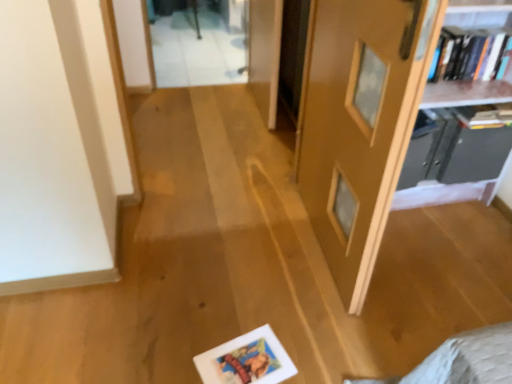
What do you see at coordinates (246, 360) in the screenshot?
I see `white matte picture frame at lower center` at bounding box center [246, 360].

From the picture: What is the approximate width of matte wooden door at center?

5.93 inches.

In order to face wooden bookshelf at upper right, arranged as the first shelf when viewed from the top, should I rotate leftwards or rightwards?

You should look right and rotate roughly 23.875 degrees.

The width and height of the screenshot is (512, 384). I want to click on wooden bookshelf at upper right, arranged as the first shelf when viewed from the top, so click(x=462, y=113).

Find the location of `black plastic shelf at upper right, marked as the 1th shelf in a bottom-to-top arrangement`. black plastic shelf at upper right, marked as the 1th shelf in a bottom-to-top arrangement is located at coordinates (453, 150).

How much space does black plastic shelf at upper right, marked as the 1th shelf in a bottom-to-top arrangement, occupy horizontally?

The width of black plastic shelf at upper right, marked as the 1th shelf in a bottom-to-top arrangement, is 17.64 inches.

Locate an element on the screen. transparent glass door at upper center is located at coordinates (196, 49).

Locate an element on the screen. The image size is (512, 384). hardcover book at upper right, which is the second book in top-to-bottom order is located at coordinates (484, 116).

Locate an element on the screen. The height and width of the screenshot is (384, 512). white matte picture frame at lower center is located at coordinates (246, 360).

Which is more to the left, white matte picture frame at lower center or hardcover book at upper right, the first book from the bottom?

white matte picture frame at lower center.

From the image's perspective, is white matte picture frame at lower center above or below hardcover book at upper right, which is the second book in top-to-bottom order?

From the image's perspective, white matte picture frame at lower center appears below hardcover book at upper right, which is the second book in top-to-bottom order.

Is white matte picture frame at lower center in contact with hardcover book at upper right, the first book from the bottom?

white matte picture frame at lower center and hardcover book at upper right, the first book from the bottom, are clearly separated.

Could you tell me if wooden bookshelf at upper right, which appears as the 2th shelf when ordered from the bottom, is turned towards white matte picture frame at lower center?

No, wooden bookshelf at upper right, which appears as the 2th shelf when ordered from the bottom, is not turned towards white matte picture frame at lower center.

Which is in front, point (432, 186) or point (213, 355)?

The point (213, 355) is in front.

The width and height of the screenshot is (512, 384). I want to click on picture frame directly beneath the wooden bookshelf at upper right, arranged as the first shelf when viewed from the top (from a real-world perspective), so click(246, 360).

Is the depth of matte wooden door at center greater than that of hardcover book at upper right, which is the second book in top-to-bottom order?

No, the depth of matte wooden door at center is less than that of hardcover book at upper right, which is the second book in top-to-bottom order.

From a real-world perspective, which is physically above, matte wooden door at center or hardcover book at upper right, which is the second book in top-to-bottom order?

matte wooden door at center is physically above.

Based on the photo, does matte wooden door at center turn towards hardcover book at upper right, which is the second book in top-to-bottom order?

No, matte wooden door at center is not aimed at hardcover book at upper right, which is the second book in top-to-bottom order.

Measure the distance between matte wooden door at center and hardcover book at upper right, which is the second book in top-to-bottom order.

The distance of matte wooden door at center from hardcover book at upper right, which is the second book in top-to-bottom order, is 59.35 centimeters.

Looking at this image, does white matte picture frame at lower center have a larger size compared to matte wooden door at center?

Actually, white matte picture frame at lower center might be smaller than matte wooden door at center.

From the image's perspective, between white matte picture frame at lower center and matte wooden door at center, which one is located above?

matte wooden door at center, from the image's perspective.

Is the position of white matte picture frame at lower center less distant than that of matte wooden door at center?

No, the depth of white matte picture frame at lower center is greater than that of matte wooden door at center.

Is white matte picture frame at lower center oriented towards matte wooden door at center?

No, white matte picture frame at lower center is not oriented towards matte wooden door at center.

What's the angular difference between black plastic shelf at upper right, which ranks as the second shelf in top-to-bottom order, and hardcover books at upper right, which is the second book from bottom to top,'s facing directions?

There is a 1.72-degree angle between the facing directions of black plastic shelf at upper right, which ranks as the second shelf in top-to-bottom order, and hardcover books at upper right, which is the second book from bottom to top.

From a real-world perspective, is black plastic shelf at upper right, marked as the 1th shelf in a bottom-to-top arrangement, above or below hardcover books at upper right, which is the second book from bottom to top?

black plastic shelf at upper right, marked as the 1th shelf in a bottom-to-top arrangement, is situated lower than hardcover books at upper right, which is the second book from bottom to top, in the real world.

Who is shorter, black plastic shelf at upper right, which ranks as the second shelf in top-to-bottom order, or hardcover books at upper right, which ranks as the 1th book in top-to-bottom order?

hardcover books at upper right, which ranks as the 1th book in top-to-bottom order, is shorter.

From the image's perspective, which one is positioned lower, black plastic shelf at upper right, marked as the 1th shelf in a bottom-to-top arrangement, or hardcover books at upper right, which is the second book from bottom to top?

black plastic shelf at upper right, marked as the 1th shelf in a bottom-to-top arrangement, from the image's perspective.

Where is `book in front of the hardcover book at upper right, which is the second book in top-to-bottom order`? This screenshot has height=384, width=512. book in front of the hardcover book at upper right, which is the second book in top-to-bottom order is located at coordinates (466, 53).

Based on their sizes in the image, would you say hardcover book at upper right, the first book from the bottom, is bigger or smaller than hardcover books at upper right, which ranks as the 1th book in top-to-bottom order?

Clearly, hardcover book at upper right, the first book from the bottom, is smaller in size than hardcover books at upper right, which ranks as the 1th book in top-to-bottom order.

Between hardcover book at upper right, the first book from the bottom, and hardcover books at upper right, which ranks as the 1th book in top-to-bottom order, which one has less height?

hardcover book at upper right, the first book from the bottom.

Between point (467, 112) and point (486, 60), which one is positioned in front?

The point (467, 112) is closer.

From the image's perspective, is transparent glass door at upper center under matte wooden door at center?

No.

Considering the relative sizes of transparent glass door at upper center and matte wooden door at center in the image provided, is transparent glass door at upper center smaller than matte wooden door at center?

Incorrect, transparent glass door at upper center is not smaller in size than matte wooden door at center.

At what (x,y) coordinates should I click in order to perform the action: click on door to the right of transparent glass door at upper center. Please return your answer as a coordinate pair (x, y). Looking at the image, I should click on (359, 123).

Is transparent glass door at upper center far away from matte wooden door at center?

Absolutely, transparent glass door at upper center is distant from matte wooden door at center.

Starting from the white matte picture frame at lower center, which book is the 2nd one behind? Please provide its 2D coordinates.

[(484, 116)]

Identify the location of picture frame on the left of wooden bookshelf at upper right, arranged as the first shelf when viewed from the top. This screenshot has width=512, height=384. (246, 360).

Estimate the real-world distances between objects in this image. Which object is closer to transparent glass door at upper center, matte wooden door at center or hardcover book at upper right, which is the second book in top-to-bottom order?

Based on the image, matte wooden door at center appears to be nearer to transparent glass door at upper center.

Which object lies further to the anchor point black plastic shelf at upper right, which ranks as the second shelf in top-to-bottom order, white matte picture frame at lower center or hardcover books at upper right, which is the second book from bottom to top?

The object further to black plastic shelf at upper right, which ranks as the second shelf in top-to-bottom order, is white matte picture frame at lower center.

Looking at the image, which one is located further to wooden bookshelf at upper right, arranged as the first shelf when viewed from the top, transparent glass door at upper center or hardcover books at upper right, which is the second book from bottom to top?

transparent glass door at upper center is further to wooden bookshelf at upper right, arranged as the first shelf when viewed from the top.

Estimate the real-world distances between objects in this image. Which object is further from white matte picture frame at lower center, matte wooden door at center or transparent glass door at upper center?

transparent glass door at upper center is further to white matte picture frame at lower center.

Based on their spatial positions, is white matte picture frame at lower center or transparent glass door at upper center closer to hardcover book at upper right, the first book from the bottom?

white matte picture frame at lower center.

Which object lies nearer to the anchor point hardcover books at upper right, which ranks as the 1th book in top-to-bottom order, transparent glass door at upper center or white matte picture frame at lower center?

Based on the image, white matte picture frame at lower center appears to be nearer to hardcover books at upper right, which ranks as the 1th book in top-to-bottom order.

From the image, which object appears to be farther from white matte picture frame at lower center, wooden bookshelf at upper right, which appears as the 2th shelf when ordered from the bottom, or matte wooden door at center?

wooden bookshelf at upper right, which appears as the 2th shelf when ordered from the bottom, is further to white matte picture frame at lower center.

Estimate the real-world distances between objects in this image. Which object is closer to matte wooden door at center, transparent glass door at upper center or white matte picture frame at lower center?

white matte picture frame at lower center is closer to matte wooden door at center.

Locate an element on the screen. door between wooden bookshelf at upper right, which appears as the 2th shelf when ordered from the bottom, and white matte picture frame at lower center from top to bottom is located at coordinates (359, 123).

Where is `door located between white matte picture frame at lower center and black plastic shelf at upper right, which ranks as the second shelf in top-to-bottom order, in the left-right direction`? door located between white matte picture frame at lower center and black plastic shelf at upper right, which ranks as the second shelf in top-to-bottom order, in the left-right direction is located at coordinates (359, 123).

The image size is (512, 384). I want to click on book located between transparent glass door at upper center and black plastic shelf at upper right, marked as the 1th shelf in a bottom-to-top arrangement, in the left-right direction, so click(466, 53).

The width and height of the screenshot is (512, 384). What are the coordinates of `book between hardcover books at upper right, which is the second book from bottom to top, and black plastic shelf at upper right, which ranks as the second shelf in top-to-bottom order, in the vertical direction` in the screenshot? It's located at (484, 116).